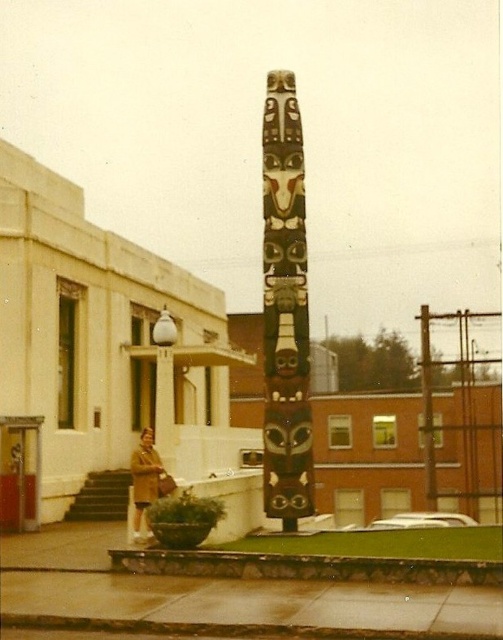
Can you confirm if carved wood totem pole at center is shorter than brown leather coat at lower left?

Incorrect, carved wood totem pole at center's height does not fall short of brown leather coat at lower left's.

Does point (277, 420) come in front of point (141, 486)?

No.

Image resolution: width=503 pixels, height=640 pixels. I want to click on carved wood totem pole at center, so tap(285, 308).